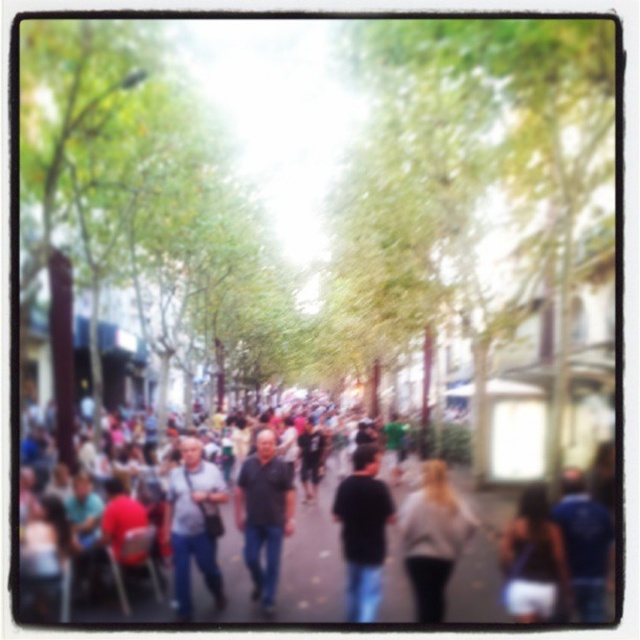
Question: Can you confirm if blue jeans at center is smaller than black matte shirt at center?

Choices:
 (A) no
 (B) yes

Answer: (A)

Question: Is green leafy tree at center positioned at the back of blue fabric shirt at center?

Choices:
 (A) no
 (B) yes

Answer: (A)

Question: Among these points, which one is farthest from the camera?

Choices:
 (A) (x=200, y=520)
 (B) (x=532, y=612)
 (C) (x=598, y=518)

Answer: (A)

Question: Which object is farther from the camera taking this photo?

Choices:
 (A) smooth asphalt road at center
 (B) blue jeans at center
 (C) dark brown leather bag at lower right
 (D) green leafy tree at center

Answer: (B)

Question: Does dark brown leather bag at lower right come behind dark gray shirt at center?

Choices:
 (A) yes
 (B) no

Answer: (B)

Question: Which point is closer to the camera taking this photo?

Choices:
 (A) (493, 573)
 (B) (534, 588)
 (C) (205, 547)

Answer: (B)